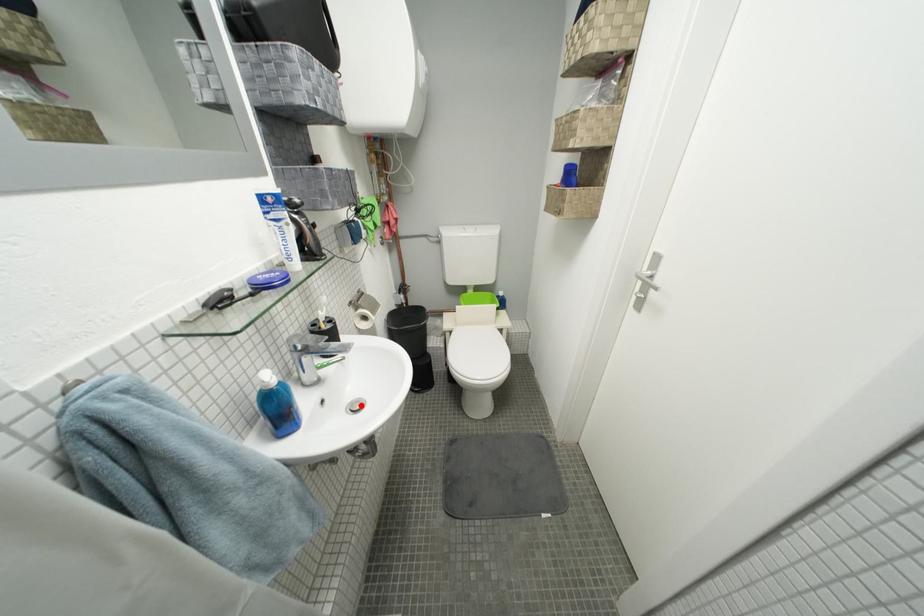
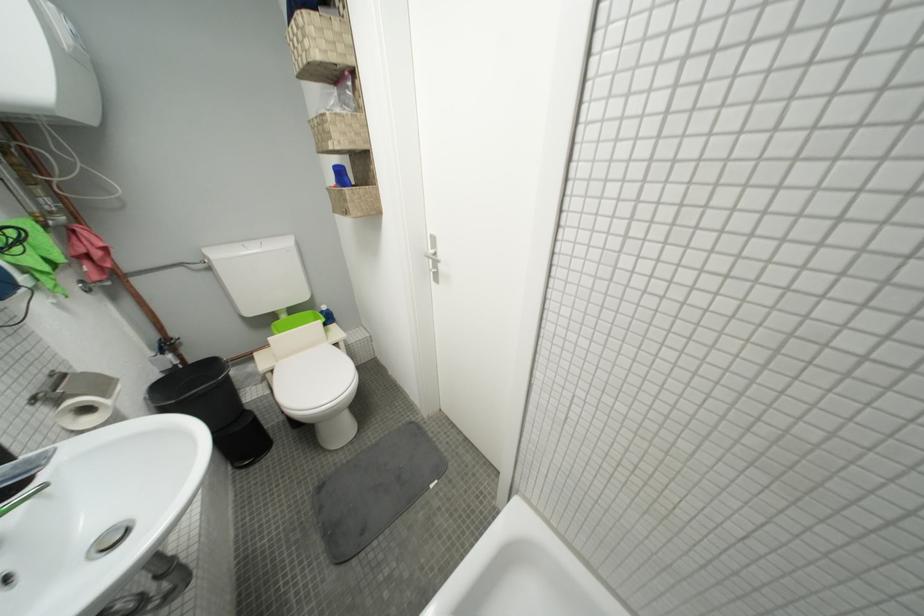
Question: I am providing you with two images of the same scene from different viewpoints. In image1, a red point is highlighted. Considering the same 3D point in image2, which of the following is correct?

Choices:
 (A) It is closer
 (B) It is farther

Answer: (B)